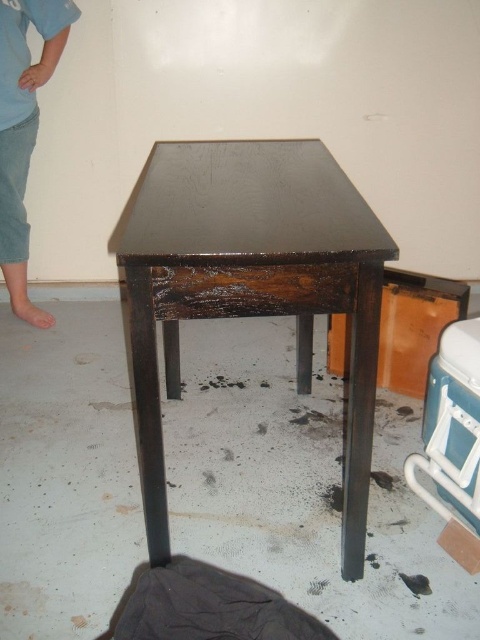
Question: Does dark wood table at center appear under light blue denim pants at left?

Choices:
 (A) no
 (B) yes

Answer: (B)

Question: Can you confirm if dark wood table at center is thinner than light blue denim pants at left?

Choices:
 (A) yes
 (B) no

Answer: (B)

Question: Which of the following is the farthest from the observer?

Choices:
 (A) light blue denim pants at left
 (B) dark wood table at center

Answer: (A)

Question: Does dark wood table at center have a larger size compared to light blue denim pants at left?

Choices:
 (A) no
 (B) yes

Answer: (B)

Question: Which object is farther from the camera taking this photo?

Choices:
 (A) dark wood table at center
 (B) light blue denim pants at left

Answer: (B)